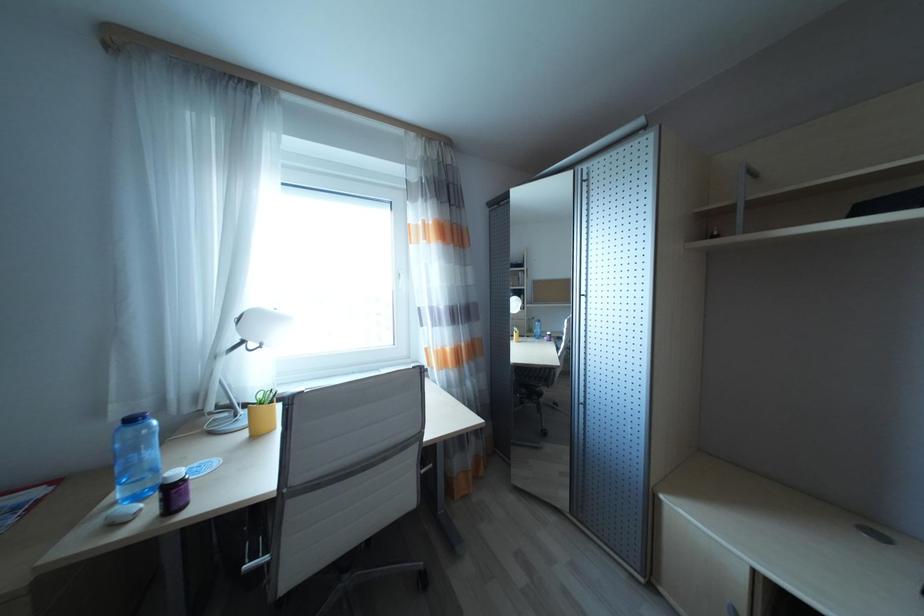
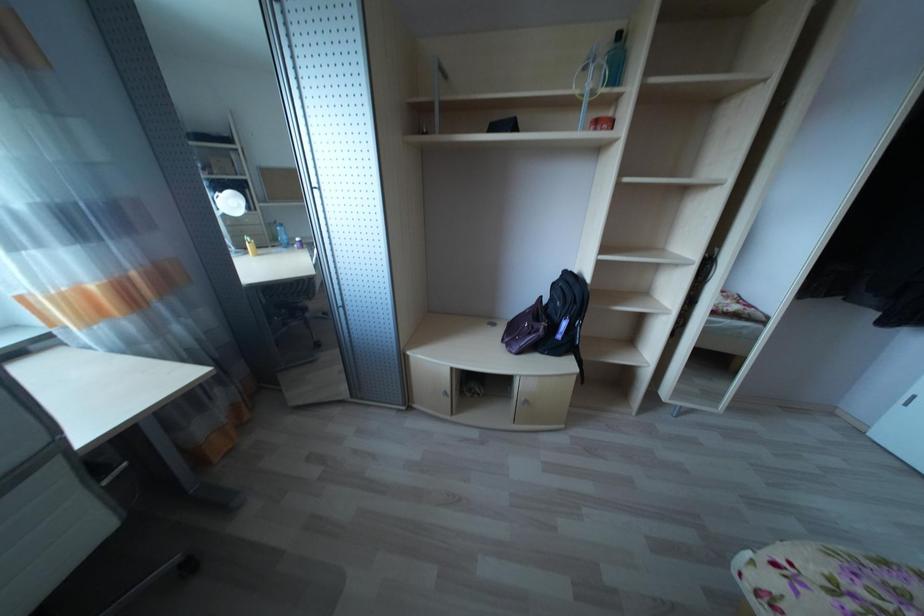
First-person continuous shooting, in which direction is the camera rotating?

The rotation direction of the camera is right-down.